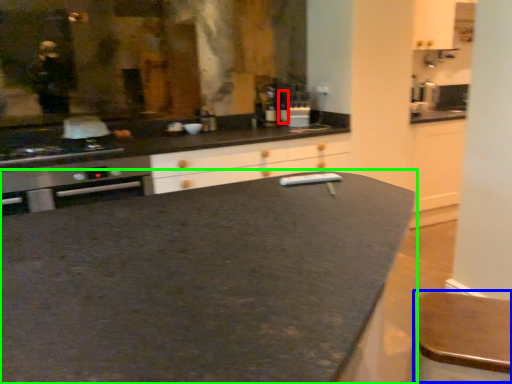
Question: Which object is the closest to the bottle (highlighted by a red box)? Choose among these: bar stool (highlighted by a blue box) or countertop (highlighted by a green box).

Choices:
 (A) bar stool
 (B) countertop

Answer: (B)